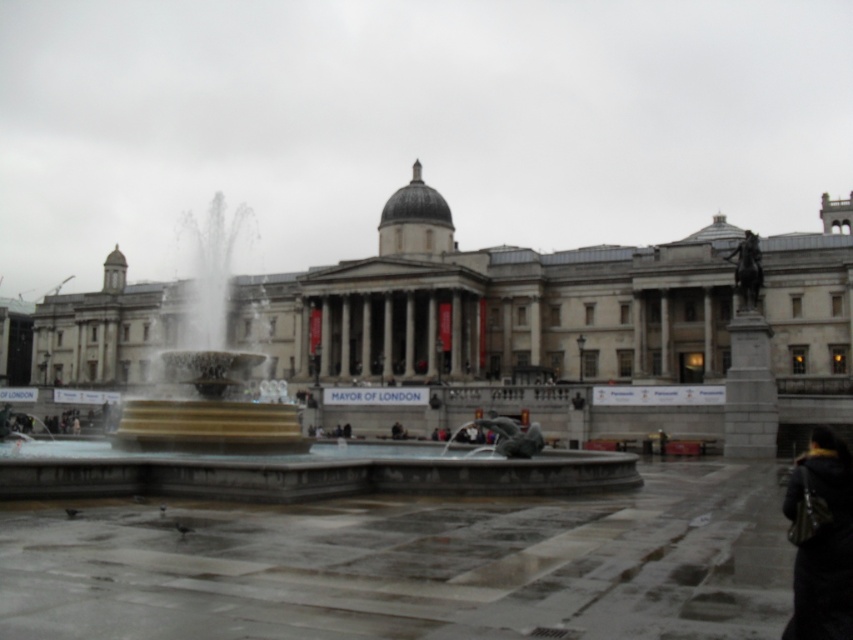
You are a photographer standing in the public square. You want to capture a photo of the silver metallic fountain at center and the black leather jacket at lower right in the same frame. Based on their sizes, will the fountain appear larger than the jacket in the photo?

Yes, the silver metallic fountain at center appears larger than the black leather jacket at lower right in the photo because it has a greater height compared to the jacket.

You are standing in the public square and want to take a photo of the silver metallic fountain at center. To ensure the fountain is in the foreground of your photo, where should you position yourself relative to the fountain?

To ensure the silver metallic fountain at center is in the foreground of your photo, you should position yourself closer to the fountain, facing away from the large classical building in the background.